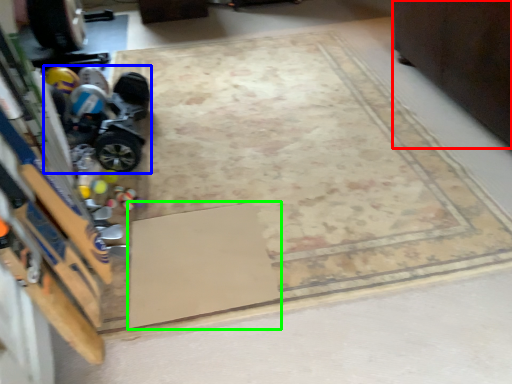
Question: Based on their relative distances, which object is nearer to furniture (highlighted by a red box)? Choose from toy car (highlighted by a blue box) and doormat (highlighted by a green box).

Choices:
 (A) toy car
 (B) doormat

Answer: (B)